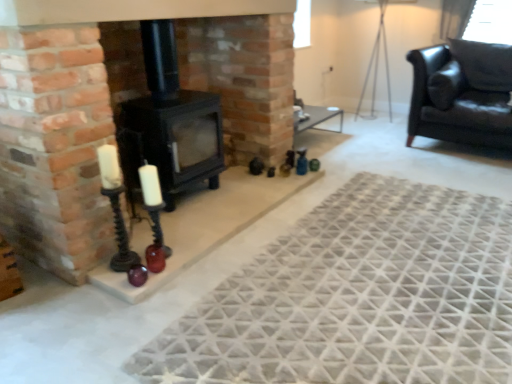
Identify the location of vacant area that lies between black matte wood burning stove at center and black glass candle holder at lower left, positioned as the 2th candle holder in left-to-right order. (183, 224).